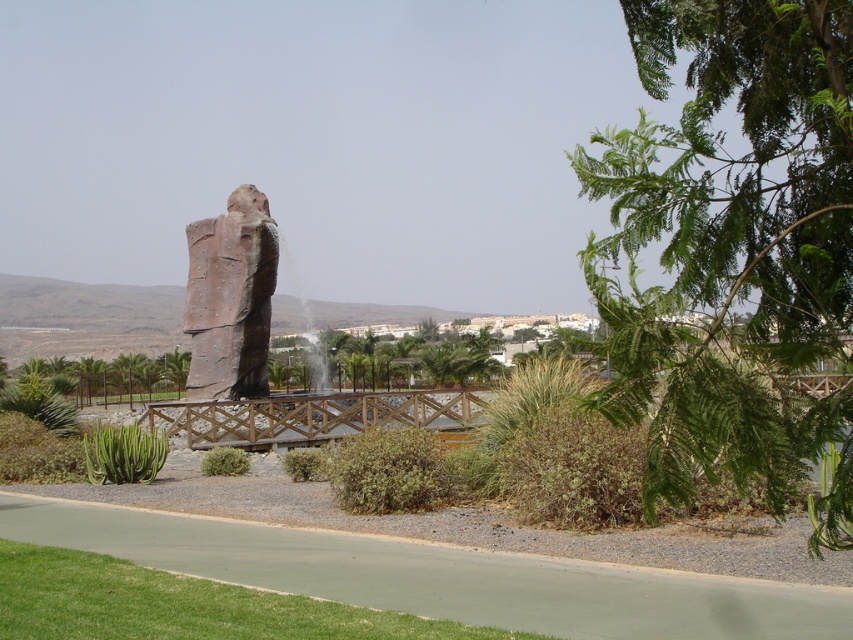
Who is more forward, (117, 378) or (154, 460)?

Point (154, 460) is more forward.

Can you confirm if green leafy tree at center is shorter than green succulent at lower left?

No, green leafy tree at center is not shorter than green succulent at lower left.

I want to click on green leafy tree at center, so click(x=109, y=376).

Does rustic stone statue at center appear over green succulent at lower left?

Correct, rustic stone statue at center is located above green succulent at lower left.

Can you confirm if rustic stone statue at center is taller than green succulent at lower left?

Yes.

Is point (223, 232) positioned in front of point (93, 461)?

No.

The height and width of the screenshot is (640, 853). I want to click on rustic stone statue at center, so click(230, 298).

Between point (467, 602) and point (103, 397), which one is positioned behind?

Point (103, 397)

Does point (90, 492) come behind point (136, 355)?

No, (90, 492) is closer to viewer.

Is point (450, 616) positioned before point (166, 371)?

That is True.

The width and height of the screenshot is (853, 640). What are the coordinates of `brown wooden bridge at center` in the screenshot? It's located at (712, 620).